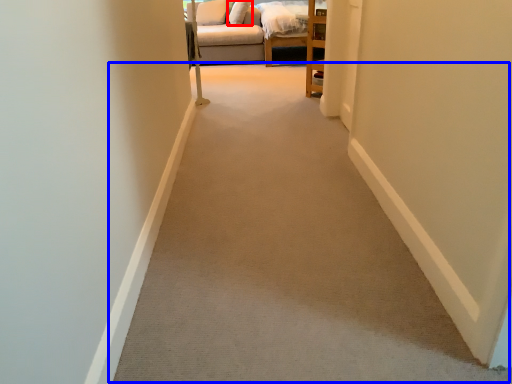
Question: Which object is closer to the camera taking this photo, pillow (highlighted by a red box) or path (highlighted by a blue box)?

Choices:
 (A) pillow
 (B) path

Answer: (B)